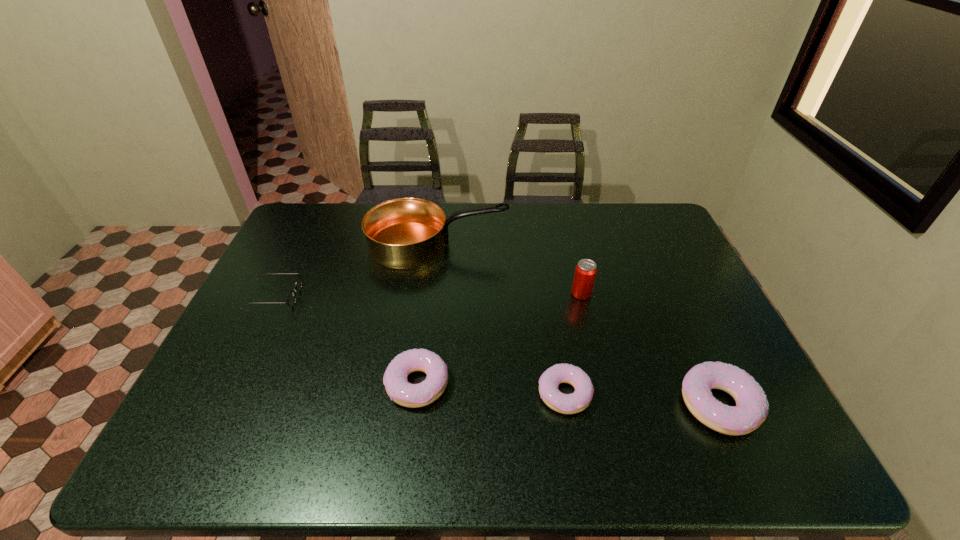
This screenshot has width=960, height=540. I want to click on vacant space that's between the rightmost object and the third object from right to left, so click(642, 400).

You are a GUI agent. You are given a task and a screenshot of the screen. Output one action in this format:
    pyautogui.click(x=<x>, y=<y>)
    Task: Click on the vacant region between the tallest object and the second tallest doughnut
    Image resolution: width=960 pixels, height=540 pixels.
    Given the screenshot: What is the action you would take?
    pyautogui.click(x=427, y=314)

Image resolution: width=960 pixels, height=540 pixels. I want to click on vacant area that lies between the second tallest doughnut and the leftmost object, so click(x=346, y=341).

The image size is (960, 540). Find the location of `empty location between the frying pan and the spectacles`. empty location between the frying pan and the spectacles is located at coordinates (356, 271).

Where is `free space between the fifth object from left to right and the farthest object`? Image resolution: width=960 pixels, height=540 pixels. free space between the fifth object from left to right and the farthest object is located at coordinates (510, 269).

At what (x,y) coordinates should I click in order to perform the action: click on empty space that is in between the leftmost doughnut and the shortest doughnut. Please return your answer as a coordinate pair (x, y). Image resolution: width=960 pixels, height=540 pixels. Looking at the image, I should click on (491, 389).

Identify which object is located as the second nearest to the fourth tallest object. Please provide its 2D coordinates. Your answer should be formatted as a tuple, i.e. [(x, y)], where the tuple contains the x and y coordinates of a point satisfying the conditions above.

[(403, 233)]

What are the coordinates of `object identified as the second closest to the frying pan` in the screenshot? It's located at (585, 272).

Where is `doughnut that stands as the third closest to the spectacles`? This screenshot has width=960, height=540. doughnut that stands as the third closest to the spectacles is located at coordinates (751, 410).

Locate which doughnut ranks in proximity to the fourth tallest object. Please provide its 2D coordinates. Your answer should be formatted as a tuple, i.e. [(x, y)], where the tuple contains the x and y coordinates of a point satisfying the conditions above.

[(579, 400)]